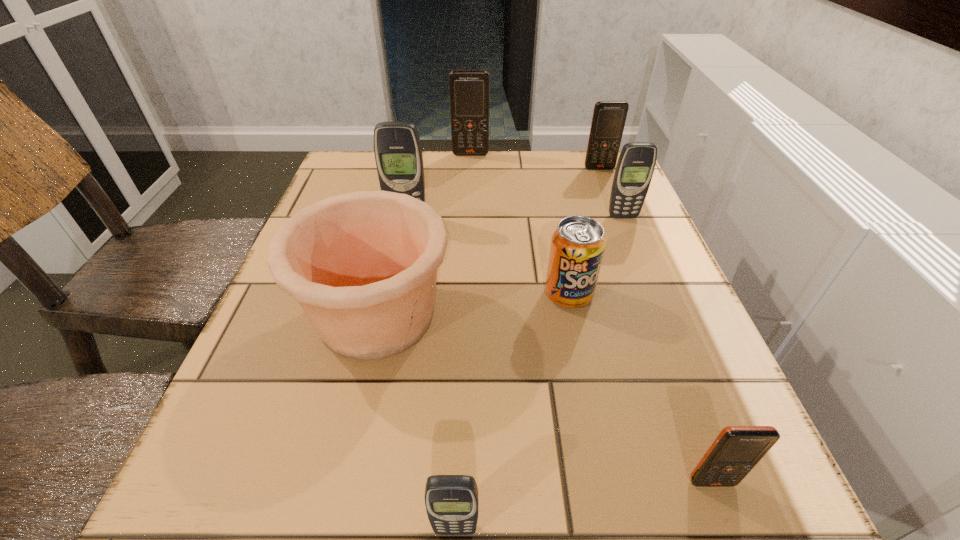
Find the location of a particular element. the biggest orange cellular telephone is located at coordinates (469, 89).

Locate an element on the screen. The image size is (960, 540). the farthest cellular telephone is located at coordinates (469, 89).

The height and width of the screenshot is (540, 960). In order to click on the leftmost gray cellular telephone in this screenshot , I will do pos(398,154).

Identify the location of the leftmost cellular telephone. (398, 154).

The image size is (960, 540). Identify the location of the second smallest gray cellular telephone. (635, 167).

Locate an element on the screen. the second farthest object is located at coordinates (609, 117).

At what (x,y) coordinates should I click in order to perform the action: click on the second nearest orange cellular telephone. Please return your answer as a coordinate pair (x, y). The image size is (960, 540). Looking at the image, I should click on (609, 117).

The height and width of the screenshot is (540, 960). Find the location of `pottery`. pottery is located at coordinates (363, 265).

Identify the location of soda can. This screenshot has height=540, width=960. (578, 244).

At what (x,y) coordinates should I click in order to perform the action: click on the nearest orange cellular telephone. Please return your answer as a coordinate pair (x, y). This screenshot has width=960, height=540. Looking at the image, I should click on (734, 453).